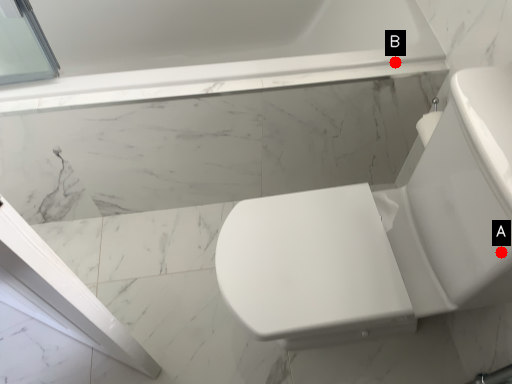
Question: Two points are circled on the image, labeled by A and B beside each circle. Among these points, which one is farthest from the camera?

Choices:
 (A) A is further
 (B) B is further

Answer: (B)